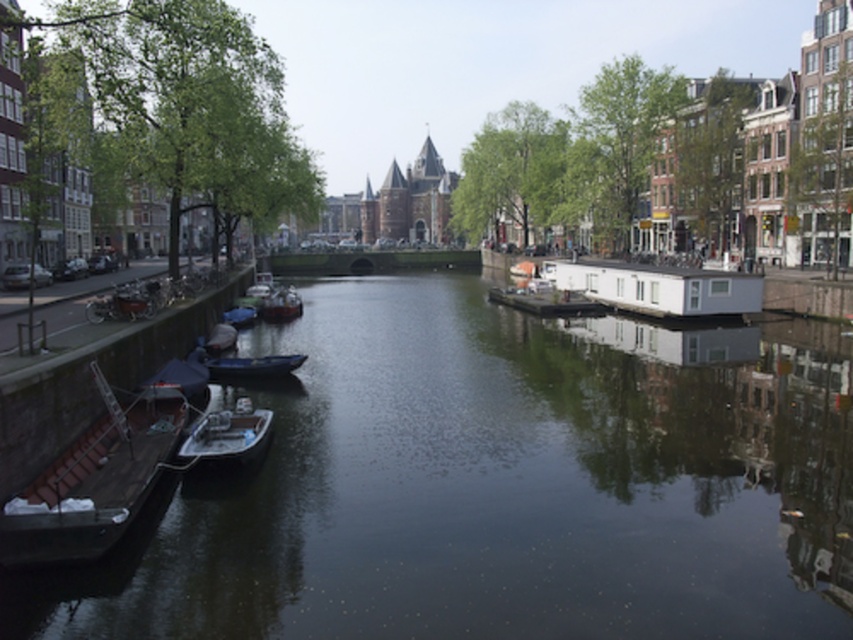
Question: Is brown wooden boat at lower left behind white glossy boat at center?

Choices:
 (A) yes
 (B) no

Answer: (B)

Question: Is green smooth water at center wider than blue matte boat at center?

Choices:
 (A) no
 (B) yes

Answer: (B)

Question: Can you confirm if brown wooden boat at lower left is bigger than blue matte boat at center?

Choices:
 (A) no
 (B) yes

Answer: (B)

Question: Among these points, which one is nearest to the camera?

Choices:
 (A) (270, 310)
 (B) (726, 499)
 (C) (30, 557)
 (D) (210, 422)

Answer: (C)

Question: Estimate the real-world distances between objects in this image. Which object is closer to the white glossy boat at lower left?

Choices:
 (A) blue matte boat at center
 (B) brown wooden boat at lower left
 (C) wooden boat at center

Answer: (B)

Question: Among these objects, which one is farthest from the camera?

Choices:
 (A) wooden boat at center
 (B) white glossy boat at center
 (C) blue matte boat at center
 (D) white glossy boat at lower left

Answer: (B)